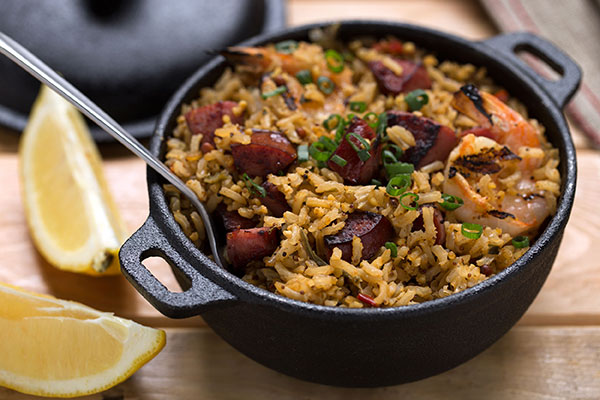
Locate an element on the screen. Image resolution: width=600 pixels, height=400 pixels. tabletop is located at coordinates coord(502,371).